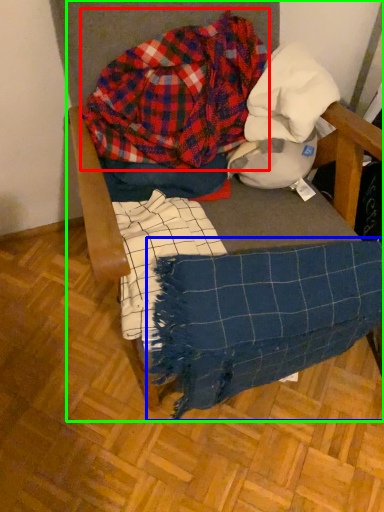
Question: Which object is positioned closest to flannel (highlighted by a red box)? Select from blanket (highlighted by a blue box) and furniture (highlighted by a green box).

Choices:
 (A) blanket
 (B) furniture

Answer: (B)